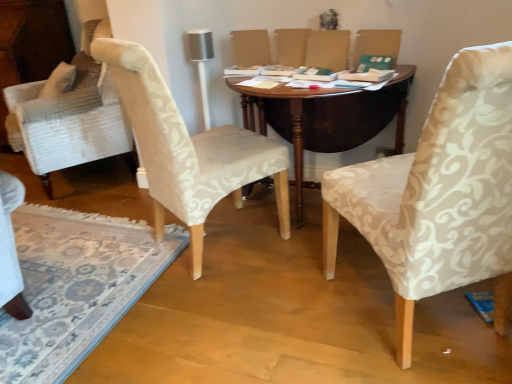
Question: Considering the positions of white textured fabric chair at left, the 1th chair viewed from the left, and beige damask chair at right, which is the 2th chair from left to right, in the image, is white textured fabric chair at left, the 1th chair viewed from the left, wider or thinner than beige damask chair at right, which is the 2th chair from left to right,?

Choices:
 (A) thin
 (B) wide

Answer: (A)

Question: Is white textured fabric chair at left, the 1th chair viewed from the left, to the left or to the right of beige damask chair at right, which is the 2th chair from left to right, in the image?

Choices:
 (A) left
 (B) right

Answer: (A)

Question: Which object is the farthest from the patterned fabric rug at lower left?

Choices:
 (A) dark wood table at center
 (B) white textured fabric chair at left, which appears as the 2th chair when viewed from the right
 (C) beige damask chair at right, which ranks as the first chair in right-to-left order

Answer: (C)

Question: Which object is the farthest from the white textured fabric chair at left, the 1th chair viewed from the left?

Choices:
 (A) beige damask chair at right, which is the 2th chair from left to right
 (B) dark wood table at center
 (C) patterned fabric rug at lower left

Answer: (A)